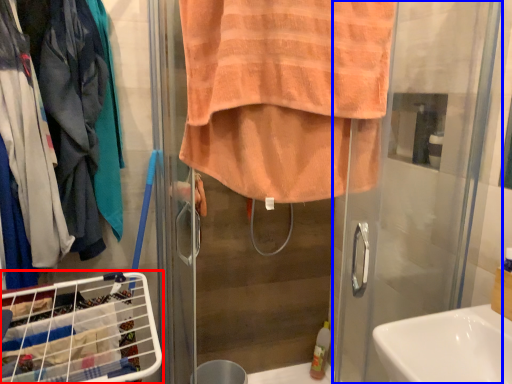
Question: Which object is closer to the camera taking this photo, laundry basket (highlighted by a red box) or screen door (highlighted by a blue box)?

Choices:
 (A) laundry basket
 (B) screen door

Answer: (B)